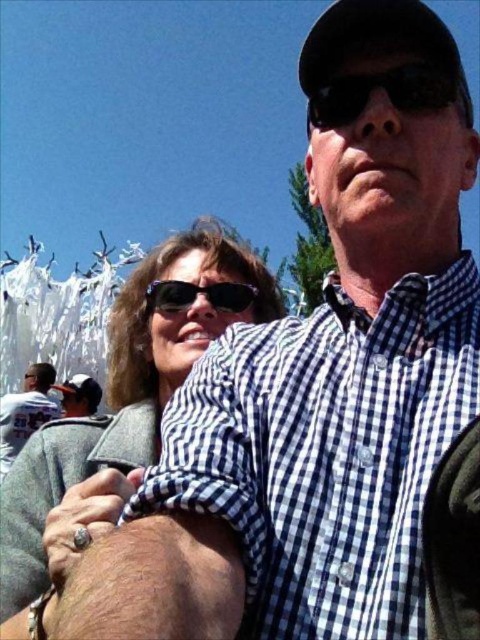
You are a photographer trying to take a picture of the matte black sunglasses at upper center and the white jersey at left. Which object should you focus on first if you want to capture both in sharp focus?

You should focus on the matte black sunglasses at upper center first because it is closer to the viewer than the white jersey at left, so adjusting focus from near to far will help both objects be in sharp focus.

In the scene shown: You are a photographer trying to capture a clear shot of both the checkered fabric shirt at center and the white jersey at left. Based on their positions, which one is blocking the view of the other?

The checkered fabric shirt at center is blocking the view of the white jersey at left because it is positioned in front of it.